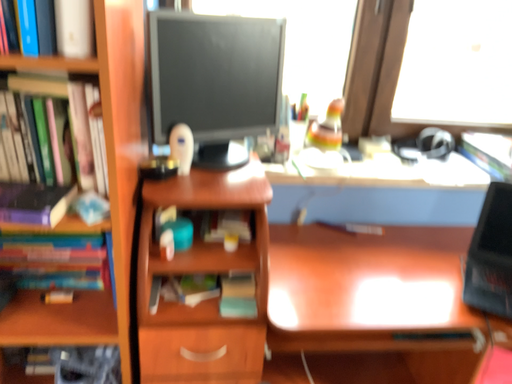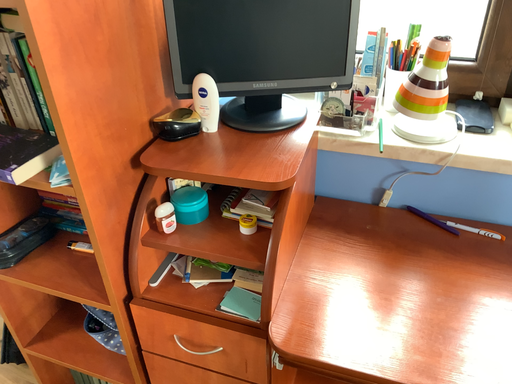
Question: How did the camera likely rotate when shooting the video?

Choices:
 (A) rotated left
 (B) rotated right

Answer: (A)